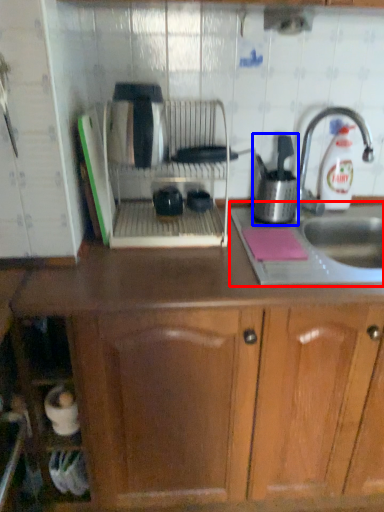
Question: Among these objects, which one is farthest to the camera, sink (highlighted by a red box) or kitchen appliance (highlighted by a blue box)?

Choices:
 (A) sink
 (B) kitchen appliance

Answer: (B)